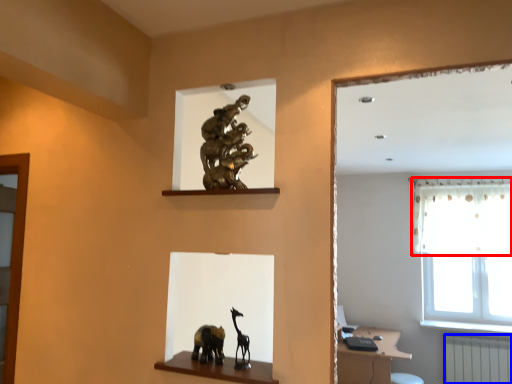
Question: Which object appears closest to the camera in this image, curtain (highlighted by a red box) or radiator (highlighted by a blue box)?

Choices:
 (A) curtain
 (B) radiator

Answer: (B)